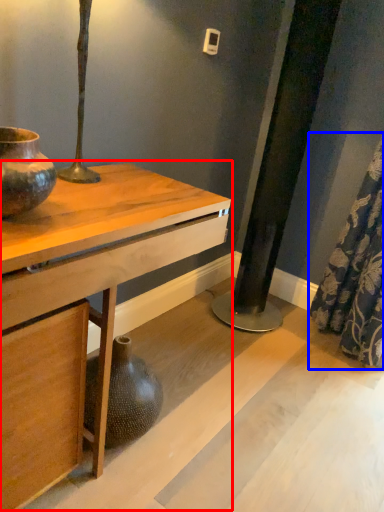
Question: Which object appears farthest to the camera in this image, table (highlighted by a red box) or shower curtain (highlighted by a blue box)?

Choices:
 (A) table
 (B) shower curtain

Answer: (B)